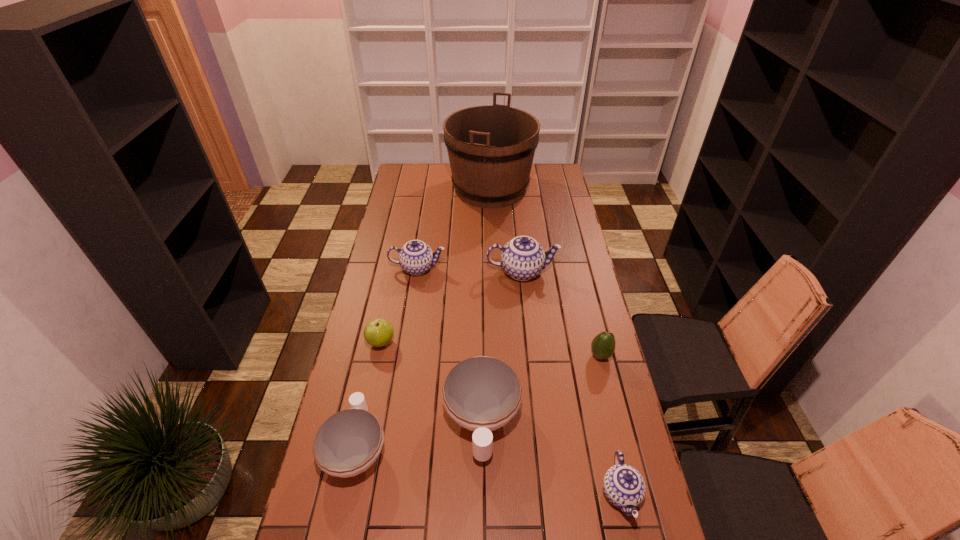
You are a GUI agent. You are given a task and a screenshot of the screen. Output one action in this format:
    pyautogui.click(x=<x>, y=<y>)
    Task: Click on the tallest object
    
    Given the screenshot: What is the action you would take?
    pyautogui.click(x=491, y=148)

Find the location of a particular element. The image size is (960, 540). bucket is located at coordinates (491, 148).

You are a GUI agent. You are given a task and a screenshot of the screen. Output one action in this format:
    pyautogui.click(x=<x>, y=<y>)
    Task: Click on the tallest chinaware
    The width and height of the screenshot is (960, 540).
    Given the screenshot: What is the action you would take?
    pyautogui.click(x=522, y=258)

The image size is (960, 540). I want to click on the second blue chinaware from left to right, so click(522, 258).

Find the location of `the second smallest blue chinaware`. the second smallest blue chinaware is located at coordinates (416, 257).

I want to click on the right white chinaware, so click(x=482, y=394).

The width and height of the screenshot is (960, 540). Identify the location of green avocado. (603, 345).

The image size is (960, 540). In order to click on green apple in this screenshot , I will do `click(379, 332)`.

At what (x,y) coordinates should I click in order to perform the action: click on the smallest blue chinaware. Please return your answer as a coordinate pair (x, y). This screenshot has width=960, height=540. Looking at the image, I should click on (624, 487).

Find the location of a particular element. Image resolution: width=960 pixels, height=540 pixels. the rightmost blue chinaware is located at coordinates (624, 487).